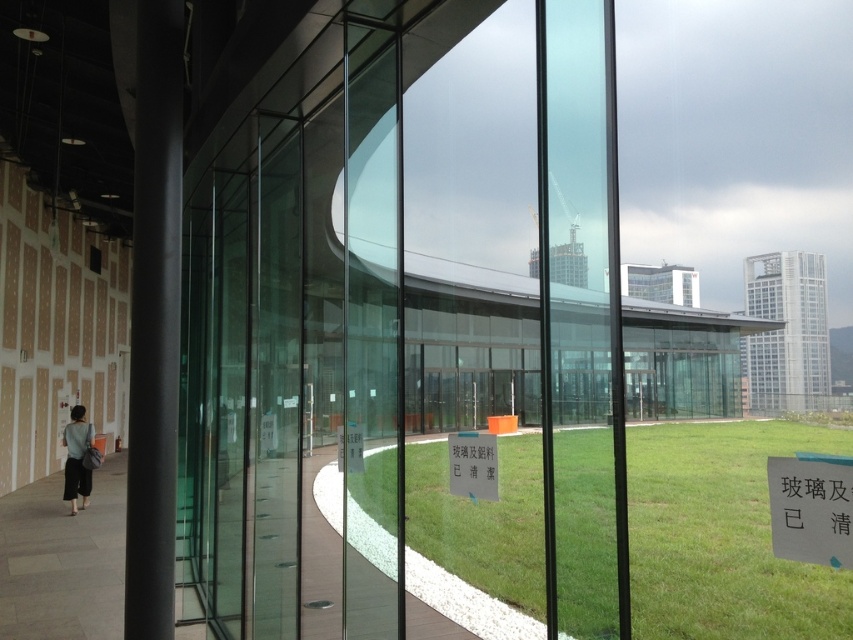
You are a delivery person holding a package that must be placed on a shelf 1.5 meters away from you. You see the transparent glass door at center. Can you reach the shelf from your current position without moving closer to it?

The distance between you and the transparent glass door at center is 1.69 meters. Since the shelf is only 1.5 meters away, you can reach it without moving closer.

What is located at the point with coordinates (473, 465)?

The green matte sign at center is located at point (473, 465).

You are a visitor at this location and need to read both the green matte sign at center and the white paper sign at center. Which sign do you need to look up at more?

The white paper sign at center is taller than the green matte sign at center, so you need to look up more to read the white paper sign at center.